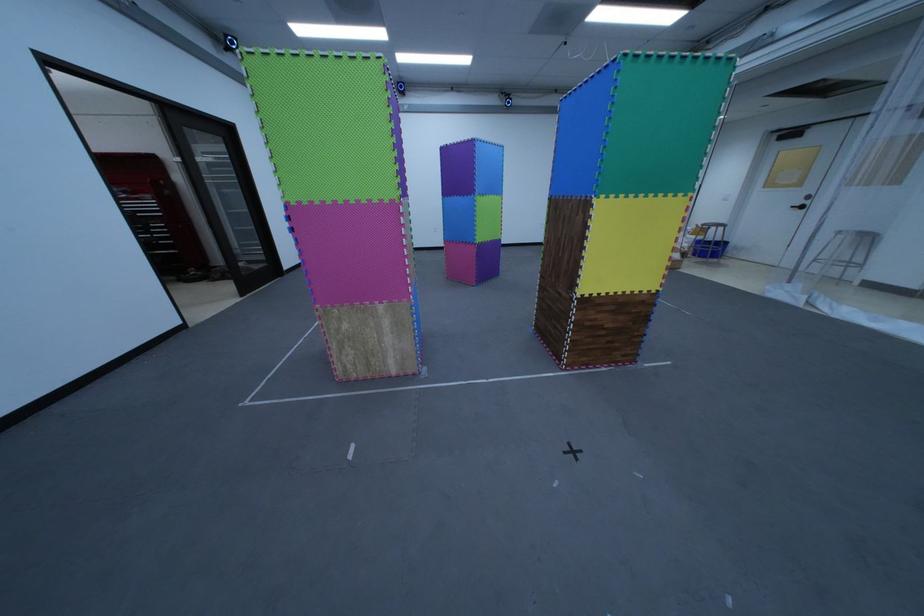
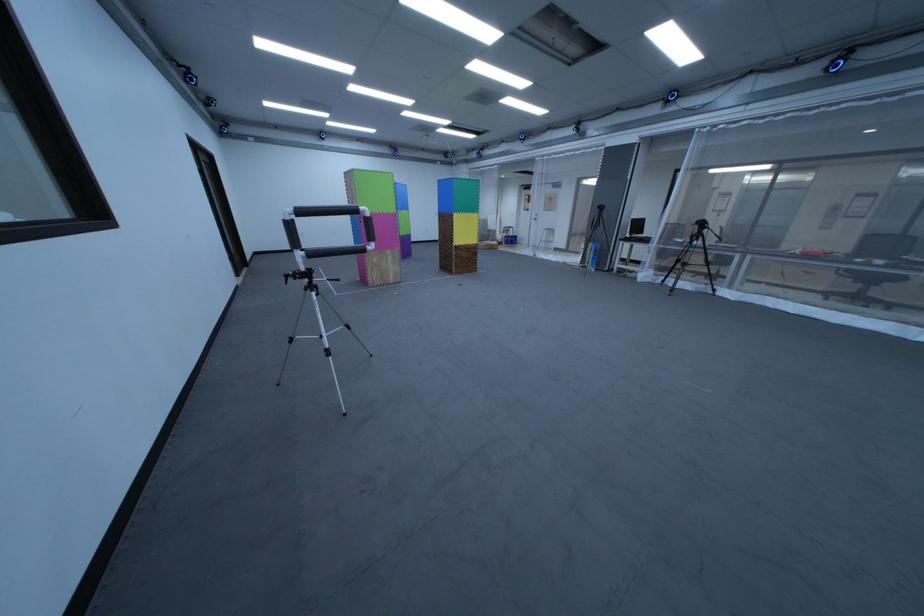
What movement of the cameraman would produce the second image?

The cameraman moved toward left, backward.